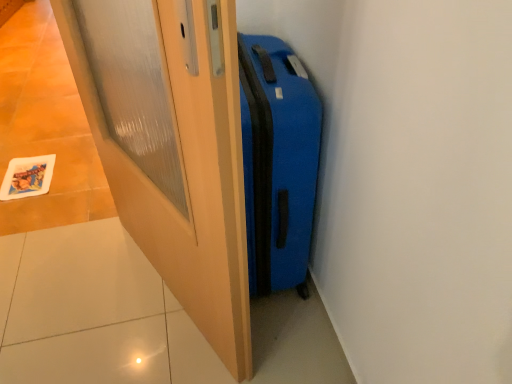
Question: Considering the positions of blue matte suitcase at center and matte wood door at center in the image, is blue matte suitcase at center wider or thinner than matte wood door at center?

Choices:
 (A) thin
 (B) wide

Answer: (B)

Question: From a real-world perspective, is blue matte suitcase at center physically located above or below matte wood door at center?

Choices:
 (A) below
 (B) above

Answer: (A)

Question: Considering the positions of point (273, 269) and point (151, 205), is point (273, 269) closer or farther from the camera than point (151, 205)?

Choices:
 (A) farther
 (B) closer

Answer: (A)

Question: Is matte wood door at center to the left or to the right of blue matte suitcase at center in the image?

Choices:
 (A) right
 (B) left

Answer: (B)

Question: Considering their positions, is matte wood door at center located in front of or behind blue matte suitcase at center?

Choices:
 (A) behind
 (B) front

Answer: (B)

Question: Is matte wood door at center inside or outside of blue matte suitcase at center?

Choices:
 (A) inside
 (B) outside

Answer: (B)

Question: From a real-world perspective, is matte wood door at center above or below blue matte suitcase at center?

Choices:
 (A) above
 (B) below

Answer: (A)